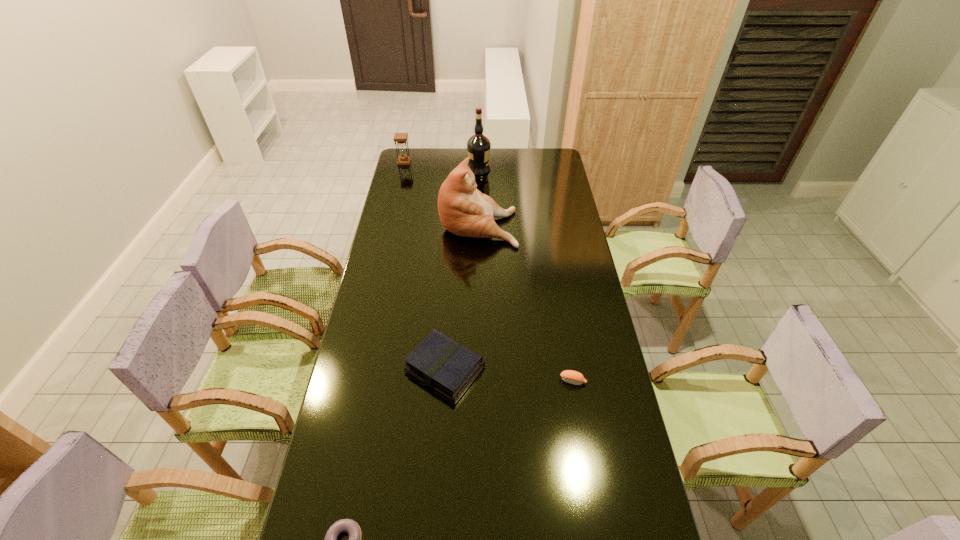
Locate an element on the screen. free space located on the front of the rightmost object is located at coordinates (585, 449).

Locate an element on the screen. The width and height of the screenshot is (960, 540). liquor located in the far edge section of the desktop is located at coordinates (478, 146).

The width and height of the screenshot is (960, 540). I want to click on hourglass that is at the far edge, so click(x=403, y=159).

You are a GUI agent. You are given a task and a screenshot of the screen. Output one action in this format:
    pyautogui.click(x=<x>, y=<y>)
    Task: Click on the object situated at the left edge
    The image size is (960, 540).
    Given the screenshot: What is the action you would take?
    pyautogui.click(x=403, y=159)

Locate an element on the screen. This screenshot has width=960, height=540. object at the right edge is located at coordinates (573, 377).

In order to click on object located in the far left corner section of the desktop in this screenshot , I will do `click(403, 159)`.

In the image, there is a desktop. Where is `vacant area at the far edge`? The width and height of the screenshot is (960, 540). vacant area at the far edge is located at coordinates (497, 154).

Locate an element on the screen. vacant space at the left edge is located at coordinates (353, 356).

In the image, there is a desktop. Where is `free space at the right edge`? The width and height of the screenshot is (960, 540). free space at the right edge is located at coordinates [x=605, y=338].

Locate an element on the screen. The width and height of the screenshot is (960, 540). vacant area at the far left corner is located at coordinates (420, 152).